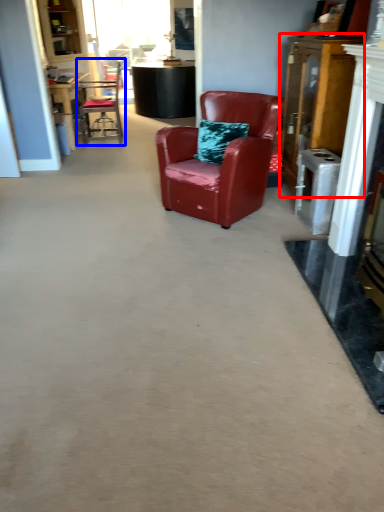
Question: Which point is further to the camera, dresser (highlighted by a red box) or chair (highlighted by a blue box)?

Choices:
 (A) dresser
 (B) chair

Answer: (B)